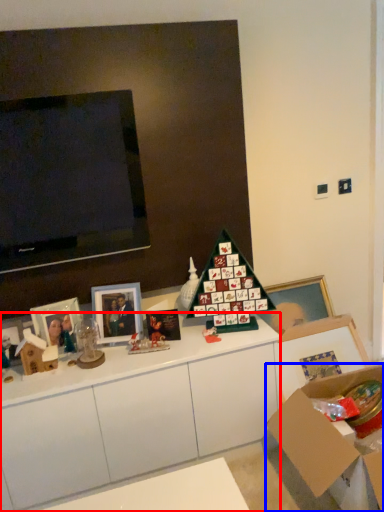
Question: Among these objects, which one is farthest to the camera, cabinetry (highlighted by a red box) or cardboard box (highlighted by a blue box)?

Choices:
 (A) cabinetry
 (B) cardboard box

Answer: (A)